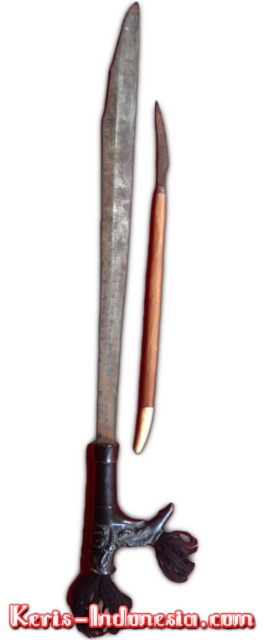
Question: Which object is farther from the camera taking this photo?

Choices:
 (A) rusty metal sword at center
 (B) wooden-handled knife at center
 (C) shiny metallic sword at center

Answer: (B)

Question: Does shiny metallic sword at center appear on the left side of black text at center?

Choices:
 (A) yes
 (B) no

Answer: (A)

Question: Which object is the closest to the wooden-handled knife at center?

Choices:
 (A) shiny metallic sword at center
 (B) rusty metal sword at center
 (C) black text at center

Answer: (A)

Question: Is rusty metal sword at center to the right of black text at center from the viewer's perspective?

Choices:
 (A) yes
 (B) no

Answer: (A)

Question: Is wooden-handled knife at center closer to camera compared to black text at center?

Choices:
 (A) no
 (B) yes

Answer: (A)

Question: Which is farther from the rusty metal sword at center?

Choices:
 (A) shiny metallic sword at center
 (B) black text at center

Answer: (B)